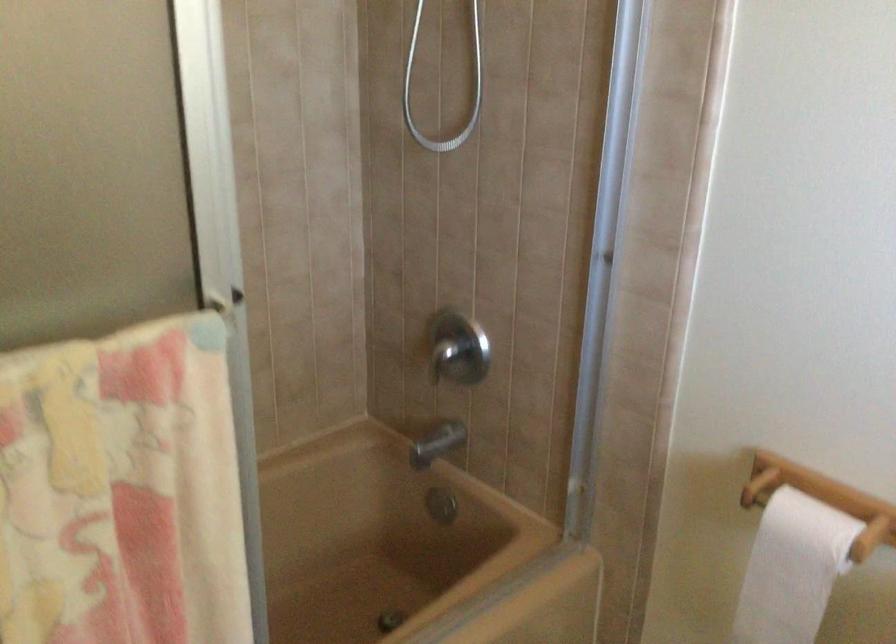
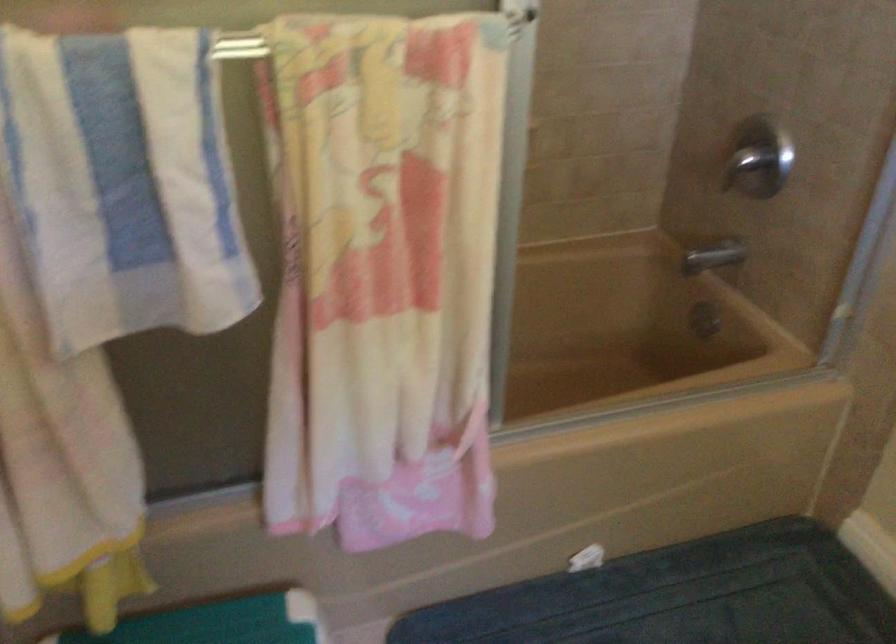
Which direction would the cameraman need to move to produce the second image?

The cameraman walked toward right, backward.